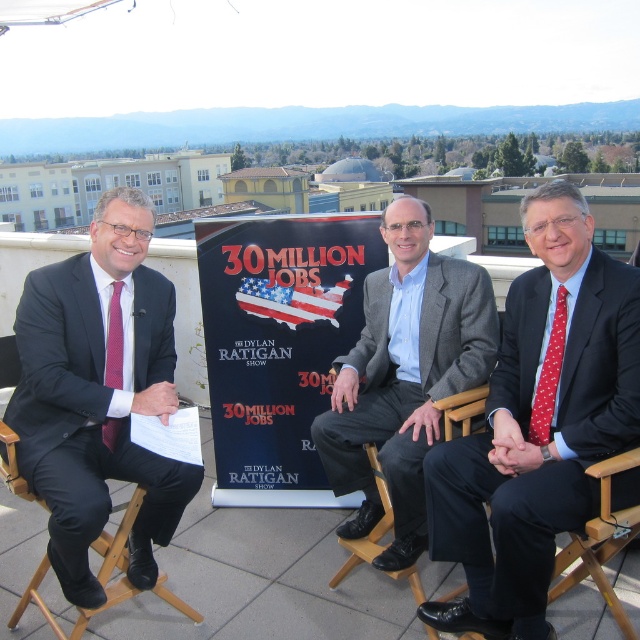
From the picture: Is matte black suit at left taller than wooden at center?

Correct, matte black suit at left is much taller as wooden at center.

Is point (74, 275) farther from camera compared to point (609, 538)?

Yes, it is.

Locate an element on the screen. matte black suit at left is located at coordinates (99, 394).

Does blue fabric poster at center appear over wooden at center?

Correct, blue fabric poster at center is located above wooden at center.

Does blue fabric poster at center have a greater height compared to wooden at center?

Yes.

Is point (282, 317) positioned in front of point (564, 552)?

No, (282, 317) is behind (564, 552).

I want to click on blue fabric poster at center, so click(278, 342).

Does wooden at center appear on the right side of red dotted tie at right?

Indeed, wooden at center is positioned on the right side of red dotted tie at right.

Between point (596, 476) and point (536, 433), which one is positioned behind?

Point (536, 433)

I want to click on wooden at center, so click(x=600, y=540).